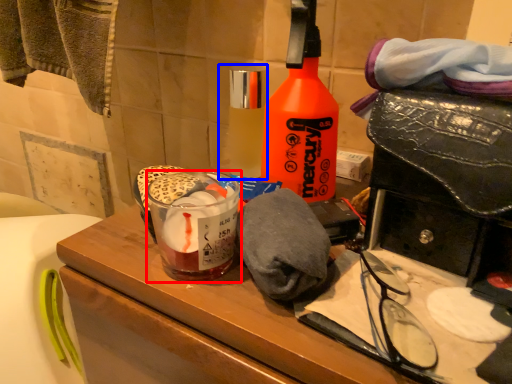
Question: Which object is closer to the camera taking this photo, beverage (highlighted by a red box) or bottle (highlighted by a blue box)?

Choices:
 (A) beverage
 (B) bottle

Answer: (A)